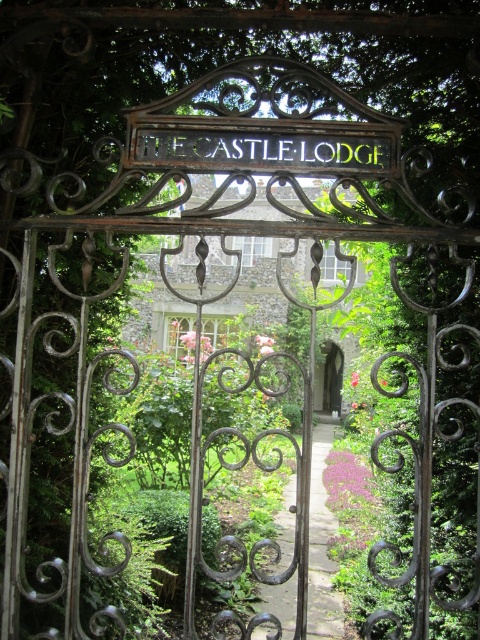
You are a visitor approaching THE CASTLE LODGE and want to take a photo of both the gold metallic sign at center and the smooth stone archway at center. Which object should you focus on first if you want to capture both in a single frame without moving your camera?

The gold metallic sign at center is shorter than the smooth stone archway at center, so you should focus on the gold metallic sign at center first to ensure it is in frame before the taller archway potentially blocks it.

You are a visitor approaching THE CASTLE LODGE and see the gold metallic sign at center and the smooth stone archway at center. Which object is located higher up in the scene?

The gold metallic sign at center is positioned over the smooth stone archway at center, so it is located higher up in the scene.

You are standing at the entrance of THE CASTLE LODGE and want to walk towards the point that is closer to you. Which point should you head towards, point [372,156] or point [339,371]?

Point [372,156] is closer to the viewer than point [339,371]. You should head towards point [372,156] since it is nearer to your current position at the entrance.